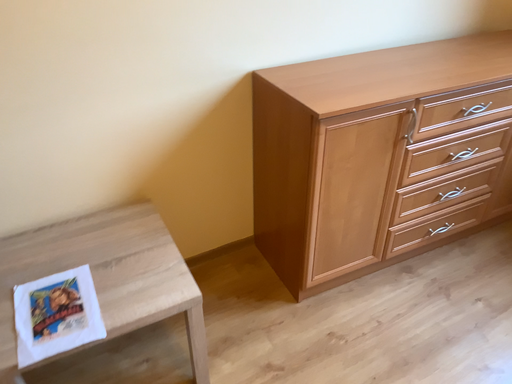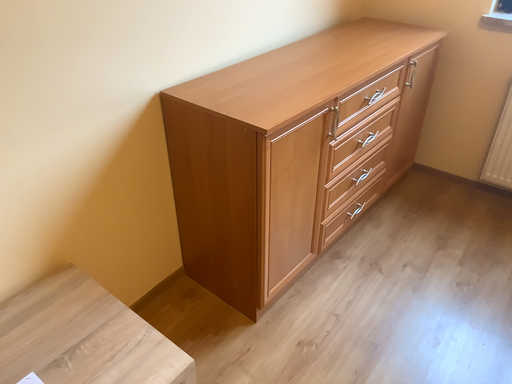
Question: How did the camera likely rotate when shooting the video?

Choices:
 (A) rotated left
 (B) rotated right

Answer: (B)